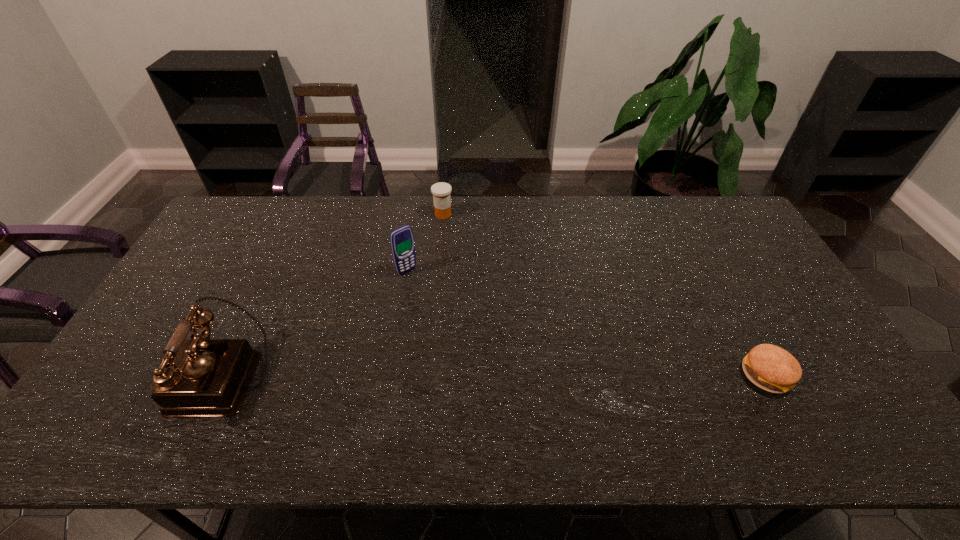
Find the location of a particular element. This screenshot has height=540, width=960. vacant area situated on the dial of the tallest object is located at coordinates (134, 377).

You are a GUI agent. You are given a task and a screenshot of the screen. Output one action in this format:
    pyautogui.click(x=<x>, y=<y>)
    Task: Click on the blank space located 0.260m on the back of the rightmost object
    The width and height of the screenshot is (960, 540).
    Given the screenshot: What is the action you would take?
    pyautogui.click(x=718, y=284)

Identify the location of vacant space located 0.340m on the label of the medicine. This screenshot has height=540, width=960. (490, 281).

This screenshot has height=540, width=960. What are the coordinates of `free spot located 0.270m on the label of the medicine` in the screenshot? It's located at (479, 267).

The width and height of the screenshot is (960, 540). Find the location of `vacant space located 0.250m on the label of the medicine`. vacant space located 0.250m on the label of the medicine is located at coordinates point(477,263).

Locate an element on the screen. vacant space situated on the front-facing side of the third shortest object is located at coordinates (482, 345).

I want to click on blank space located on the front-facing side of the third shortest object, so click(x=489, y=352).

Locate an element on the screen. vacant space situated on the front-facing side of the third shortest object is located at coordinates (433, 296).

Find the location of a particular element. The image size is (960, 540). object that is at the far edge is located at coordinates (441, 191).

Identify the location of telephone that is positioned at the near edge. (199, 377).